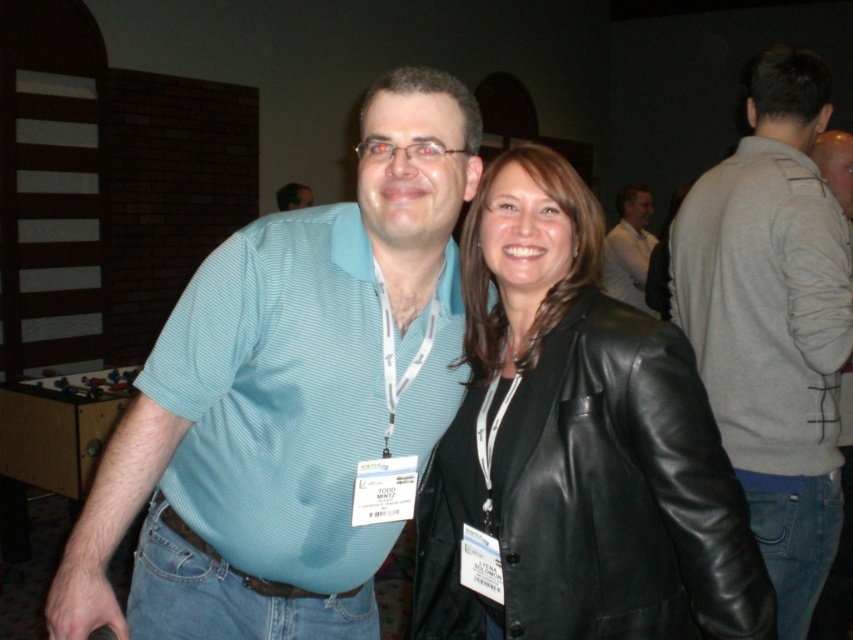
Which is in front, point (407, 314) or point (289, 189)?

Point (407, 314) is in front.

Between teal striped shirt at center and smooth skin at center, which one has more height?

teal striped shirt at center is taller.

Looking at this image, who is more forward, [157,497] or [281,208]?

Point [157,497] is more forward.

Find the location of a particular element. The image size is (853, 640). teal striped shirt at center is located at coordinates (291, 401).

Measure the distance between point (611, 241) and camera.

Point (611, 241) and camera are 4.90 meters apart.

Can you confirm if white matte shirt at upper center is positioned to the right of smooth skin at center?

Indeed, white matte shirt at upper center is positioned on the right side of smooth skin at center.

Does point (645, 284) come farther from viewer compared to point (282, 205)?

That is False.

Identify the location of white matte shirt at upper center. (630, 248).

Who is positioned more to the right, black leather jacket at center or white matte shirt at upper center?

white matte shirt at upper center is more to the right.

Who is positioned more to the left, black leather jacket at center or white matte shirt at upper center?

From the viewer's perspective, black leather jacket at center appears more on the left side.

Which is in front, point (480, 492) or point (643, 211)?

Point (480, 492)

Find the location of `black leather jacket at center`. black leather jacket at center is located at coordinates (576, 445).